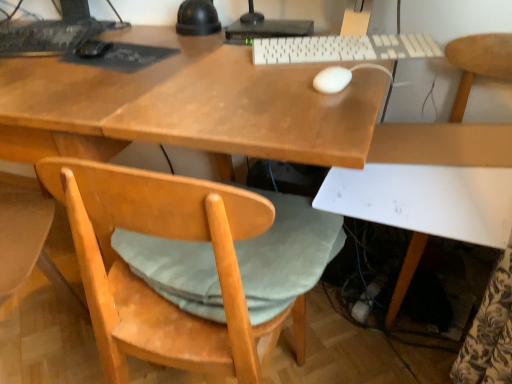
At what (x,y) coordinates should I click in order to perform the action: click on vacant region to the right of black matte mouse at upper left, which ranks as the second mouse in front-to-back order. Please return your answer as a coordinate pair (x, y). Looking at the image, I should click on (179, 48).